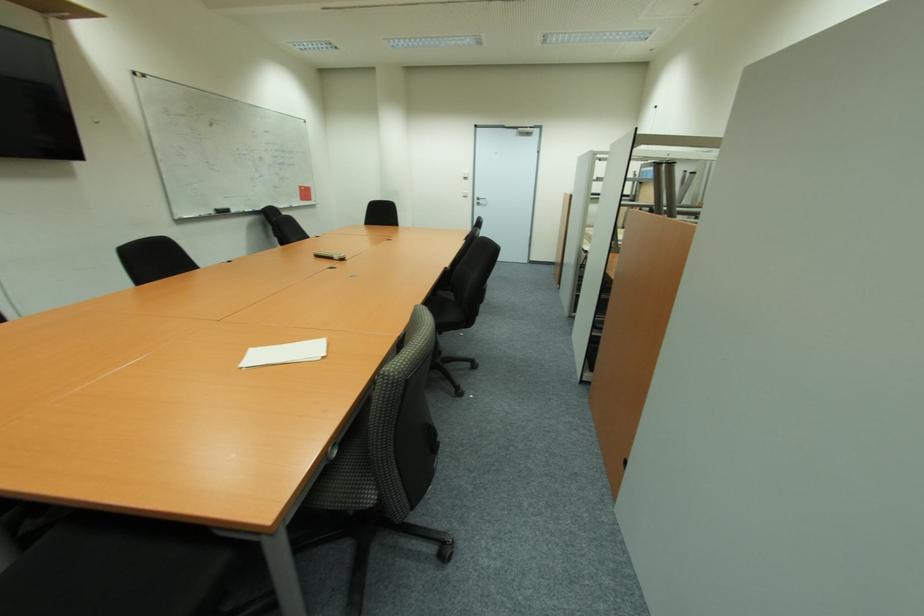
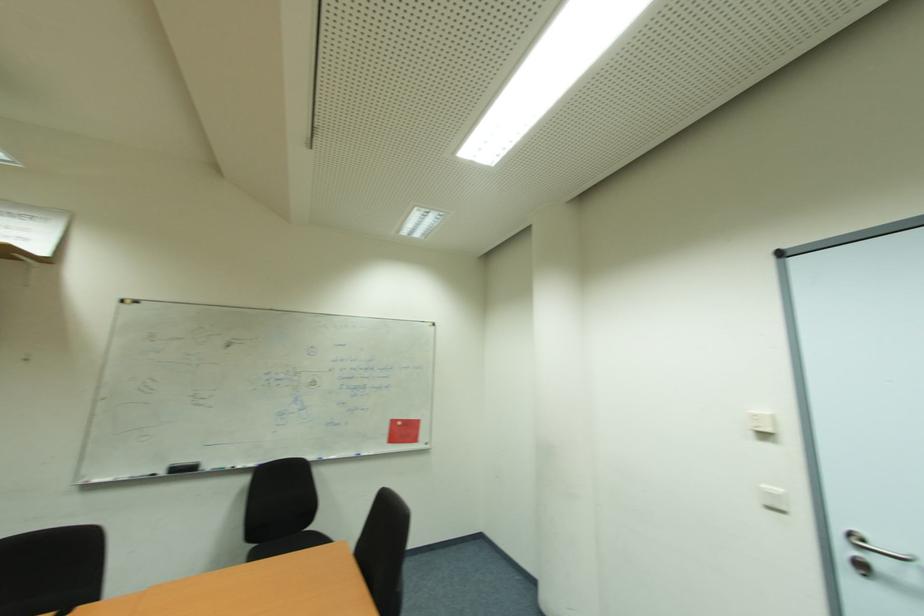
Find the pixel in the second image that matches [225,214] in the first image.

(189, 469)